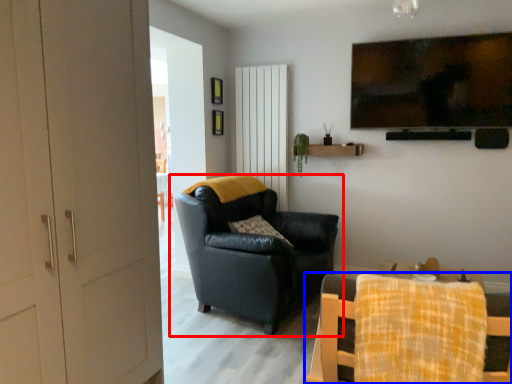
Question: Which point is further to the camera, chair (highlighted by a red box) or chair (highlighted by a blue box)?

Choices:
 (A) chair
 (B) chair

Answer: (A)